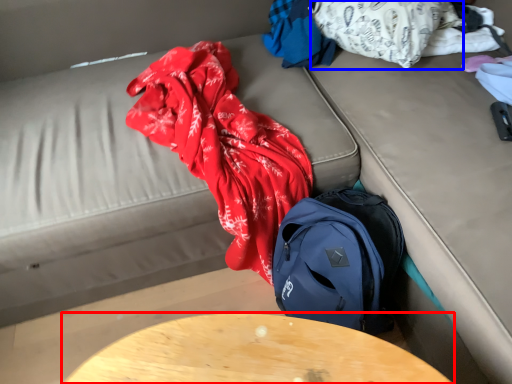
Question: Which object appears farthest to the camera in this image, table (highlighted by a red box) or clothing (highlighted by a blue box)?

Choices:
 (A) table
 (B) clothing

Answer: (B)